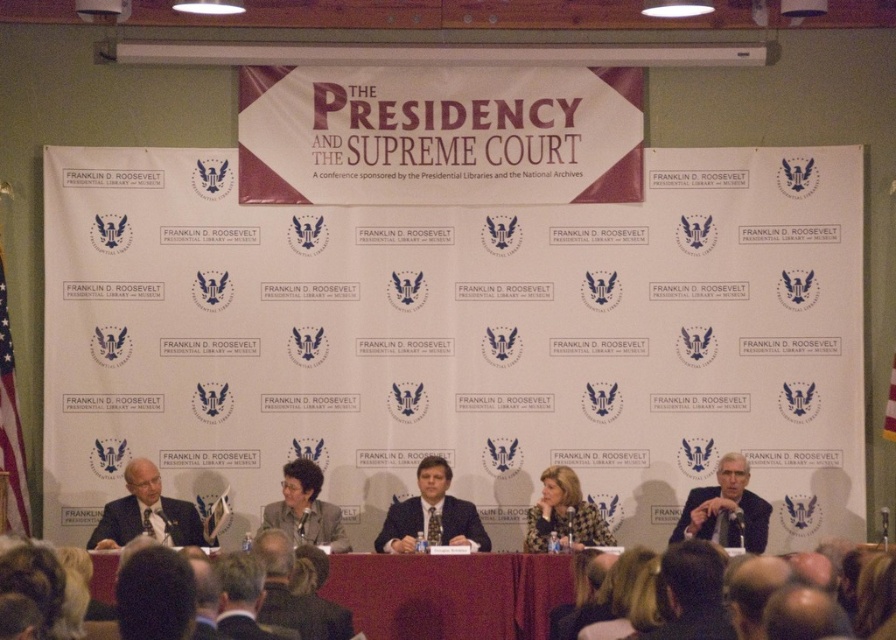
Is matte black suit at left further to camera compared to gray fabric jacket at center?

Yes, it is.

Image resolution: width=896 pixels, height=640 pixels. I want to click on matte black suit at left, so click(145, 513).

Where is `matte black suit at left`? matte black suit at left is located at coordinates (145, 513).

Between matte black suit at center and gray fabric jacket at center, which one is positioned higher?

Positioned higher is matte black suit at center.

Does matte black suit at center appear under gray fabric jacket at center?

Actually, matte black suit at center is above gray fabric jacket at center.

Is point (449, 540) positioned behind point (306, 508)?

No, (449, 540) is in front of (306, 508).

You are a GUI agent. You are given a task and a screenshot of the screen. Output one action in this format:
    pyautogui.click(x=<x>, y=<y>)
    Task: Click on the matte black suit at center
    
    Given the screenshot: What is the action you would take?
    pyautogui.click(x=431, y=515)

Is matte black suit at center to the right of matte black suit at left from the viewer's perspective?

Yes, matte black suit at center is to the right of matte black suit at left.

How distant is matte black suit at center from matte black suit at left?

A distance of 4.94 meters exists between matte black suit at center and matte black suit at left.

Which is in front, point (444, 545) or point (92, 547)?

Positioned in front is point (92, 547).

Image resolution: width=896 pixels, height=640 pixels. I want to click on matte black suit at center, so click(x=431, y=515).